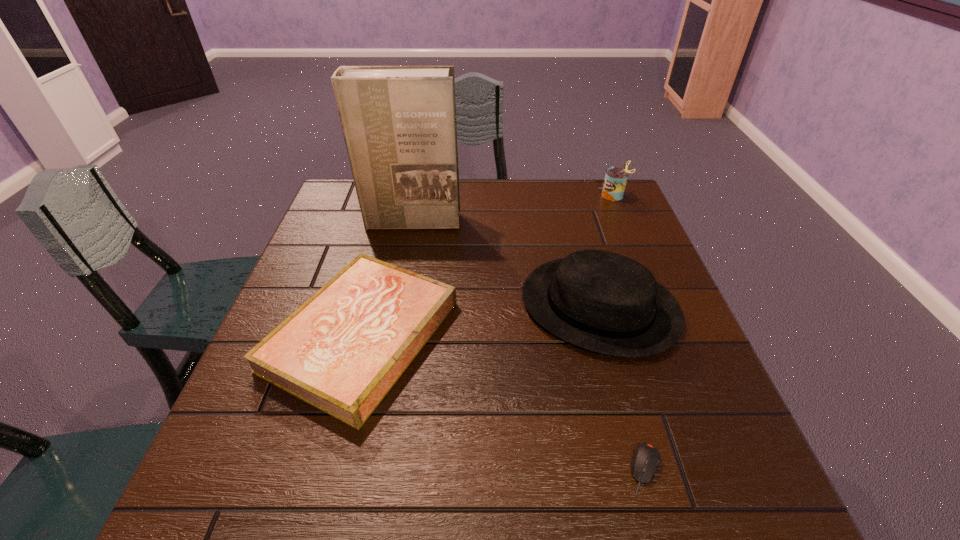
Locate an element on the screen. Image resolution: width=960 pixels, height=540 pixels. free space between the tallest object and the computer mouse is located at coordinates (529, 345).

Find the location of a particular element. vacant space that is in between the phonebook and the shortest object is located at coordinates (529, 345).

Where is `vacant space that is in between the fedora and the hardback book`? This screenshot has height=540, width=960. vacant space that is in between the fedora and the hardback book is located at coordinates (481, 321).

Locate an element on the screen. This screenshot has width=960, height=540. unoccupied area between the tallest object and the farthest object is located at coordinates (512, 209).

This screenshot has width=960, height=540. Find the location of `free spot between the tallest object and the fedora`. free spot between the tallest object and the fedora is located at coordinates (506, 264).

Find the location of a particular element. unoccupied area between the second farthest object and the fedora is located at coordinates (506, 264).

Identify which object is located as the second nearest to the second farthest object. Please provide its 2D coordinates. Your answer should be formatted as a tuple, i.e. [(x, y)], where the tuple contains the x and y coordinates of a point satisfying the conditions above.

[(600, 301)]

Locate an element on the screen. The width and height of the screenshot is (960, 540). object that stands as the fourth closest to the can is located at coordinates (646, 459).

This screenshot has height=540, width=960. Identify the location of free space that satisfies the following two spatial constraints: 1. on the front side of the nearest object; 2. on the right side of the fedora. (644, 468).

Find the location of `vacant space that satisfies the following two spatial constraints: 1. on the front side of the shortest object; 2. on the right side of the second shortest object`. vacant space that satisfies the following two spatial constraints: 1. on the front side of the shortest object; 2. on the right side of the second shortest object is located at coordinates (328, 468).